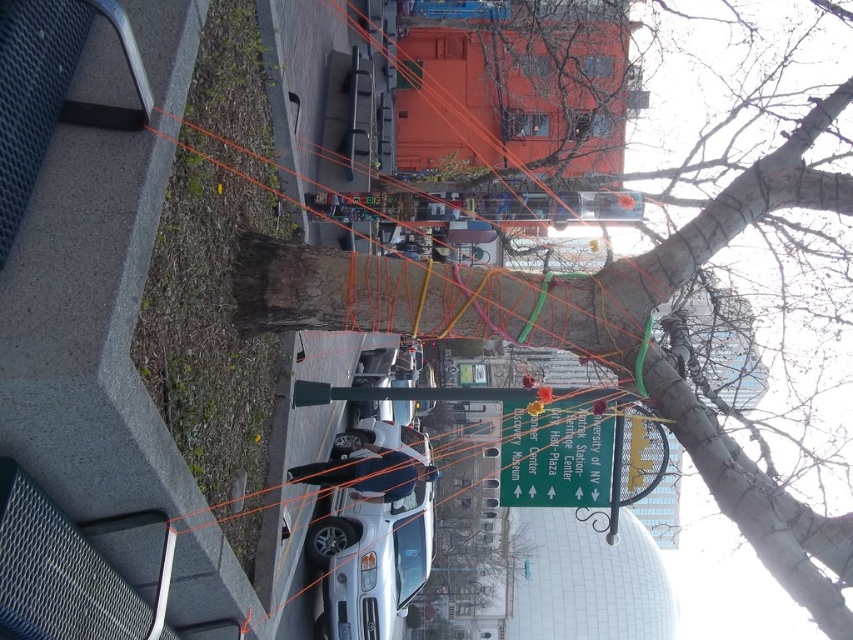
Does white matte car at center have a smaller size compared to green glossy street sign at center?

Actually, white matte car at center might be larger than green glossy street sign at center.

Can you confirm if white matte car at center is thinner than green glossy street sign at center?

In fact, white matte car at center might be wider than green glossy street sign at center.

What do you see at coordinates (370, 561) in the screenshot? I see `white matte car at center` at bounding box center [370, 561].

You are a GUI agent. You are given a task and a screenshot of the screen. Output one action in this format:
    pyautogui.click(x=<x>, y=<y>)
    Task: Click on the white matte car at center
    This screenshot has width=853, height=640.
    Given the screenshot: What is the action you would take?
    pyautogui.click(x=370, y=561)

Between point (711, 198) and point (541, 424), which one is positioned behind?

The point (541, 424) is behind.

The width and height of the screenshot is (853, 640). What do you see at coordinates (695, 241) in the screenshot?
I see `bark textured tree at center` at bounding box center [695, 241].

Is point (815, 620) positioned after point (570, 502)?

No, (815, 620) is in front of (570, 502).

Locate an element on the screen. Image resolution: width=853 pixels, height=640 pixels. bark textured tree at center is located at coordinates (695, 241).

Who is lower down, bark textured tree at center or white matte car at center?

white matte car at center is below.

Does bark textured tree at center have a greater width compared to white matte car at center?

Yes, bark textured tree at center is wider than white matte car at center.

The image size is (853, 640). Find the location of `bark textured tree at center`. bark textured tree at center is located at coordinates tap(695, 241).